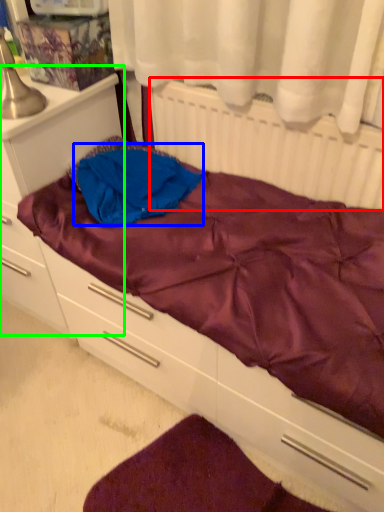
Question: Estimate the real-world distances between objects in this image. Which object is farther from radiator (highlighted by a red box), clothing (highlighted by a blue box) or file cabinet (highlighted by a green box)?

Choices:
 (A) clothing
 (B) file cabinet

Answer: (B)